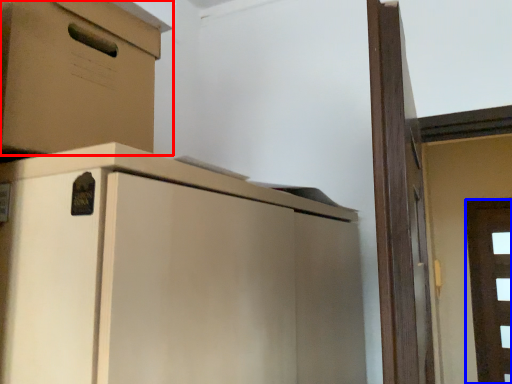
Question: Which object is closer to the camera taking this photo, cabinetry (highlighted by a red box) or door (highlighted by a blue box)?

Choices:
 (A) cabinetry
 (B) door

Answer: (A)